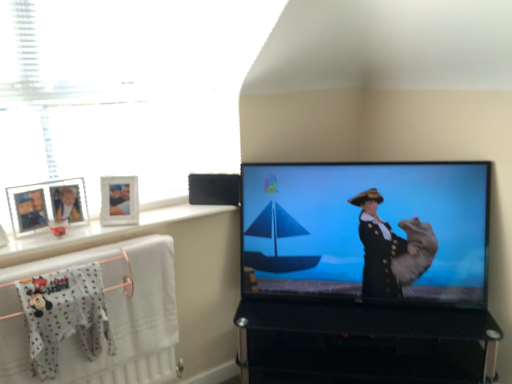
Question: From a real-world perspective, is matte black screen at right on top of white glossy window sill at upper left?

Choices:
 (A) yes
 (B) no

Answer: (B)

Question: Are matte black screen at right and white glossy window sill at upper left beside each other?

Choices:
 (A) yes
 (B) no

Answer: (B)

Question: Is matte black screen at right to the left of white glossy window sill at upper left from the viewer's perspective?

Choices:
 (A) yes
 (B) no

Answer: (B)

Question: From a real-world perspective, is matte black screen at right located beneath white glossy window sill at upper left?

Choices:
 (A) yes
 (B) no

Answer: (A)

Question: Does matte black screen at right have a smaller size compared to white glossy window sill at upper left?

Choices:
 (A) no
 (B) yes

Answer: (A)

Question: From the image's perspective, is matte black screen at right beneath white glossy window sill at upper left?

Choices:
 (A) no
 (B) yes

Answer: (B)

Question: From a real-world perspective, does black glass tv stand at lower right stand above white plastic picture frame at upper left?

Choices:
 (A) yes
 (B) no

Answer: (B)

Question: From the image's perspective, is black glass tv stand at lower right under white plastic picture frame at upper left?

Choices:
 (A) no
 (B) yes

Answer: (B)

Question: Does black glass tv stand at lower right have a lesser width compared to white plastic picture frame at upper left?

Choices:
 (A) no
 (B) yes

Answer: (A)

Question: Is black glass tv stand at lower right to the right of white plastic picture frame at upper left from the viewer's perspective?

Choices:
 (A) no
 (B) yes

Answer: (B)

Question: Can you confirm if black glass tv stand at lower right is positioned to the left of white plastic picture frame at upper left?

Choices:
 (A) no
 (B) yes

Answer: (A)

Question: Considering the relative sizes of black glass tv stand at lower right and white plastic picture frame at upper left in the image provided, is black glass tv stand at lower right bigger than white plastic picture frame at upper left?

Choices:
 (A) yes
 (B) no

Answer: (A)

Question: From a real-world perspective, is black glass tv stand at lower right located beneath white textured towel at lower left?

Choices:
 (A) no
 (B) yes

Answer: (B)